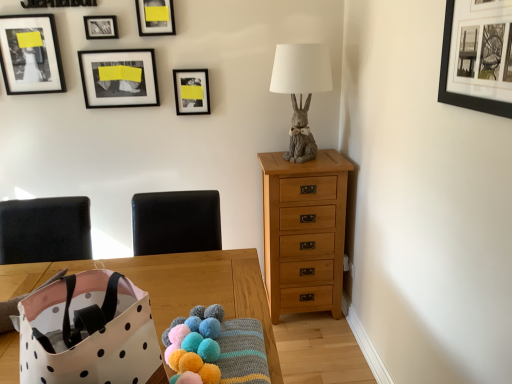
Question: Is black leather armchair at center bigger or smaller than white polka dot fabric bag at lower left?

Choices:
 (A) big
 (B) small

Answer: (B)

Question: In the image, is black leather armchair at center on the left side or the right side of white polka dot fabric bag at lower left?

Choices:
 (A) right
 (B) left

Answer: (A)

Question: Which is nearer to the matte black picture frame at upper center, which is the 1th picture frame from back to front?

Choices:
 (A) matte black picture frame at upper center, which is the third picture frame from front to back
 (B) light brown wood chest of drawers at right
 (C) matte gray rabbit at upper right
 (D) fluffy yarn balls at lower center
 (E) white polka dot fabric bag at lower left

Answer: (A)

Question: Which object is positioned farthest from the light brown wood chest of drawers at right?

Choices:
 (A) wooden table at center
 (B) matte black picture frame at upper left, which appears as the 2th picture frame when viewed from the front
 (C) fluffy yarn balls at lower center
 (D) metallic silver picture frame at upper center, which is the 5th picture frame in right-to-left order
 (E) white polka dot fabric bag at lower left

Answer: (B)